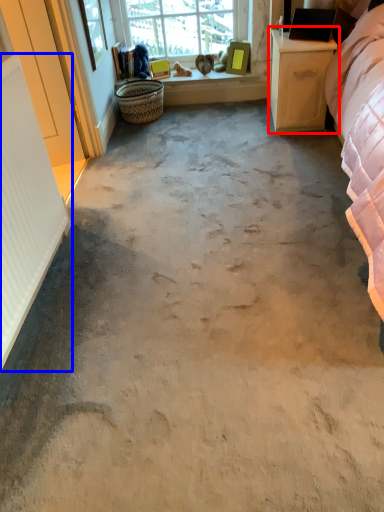
Question: Among these objects, which one is farthest to the camera, nightstand (highlighted by a red box) or radiator (highlighted by a blue box)?

Choices:
 (A) nightstand
 (B) radiator

Answer: (A)